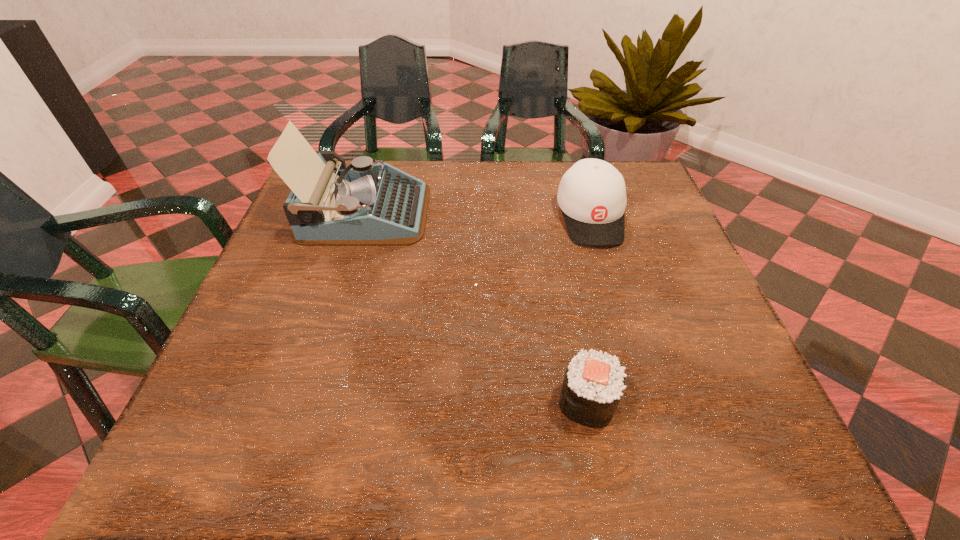
Identify the location of object situated at the near edge. (593, 384).

Identify the location of object at the left edge. The width and height of the screenshot is (960, 540). (366, 204).

Where is `object present at the right edge`? object present at the right edge is located at coordinates (592, 194).

Locate an element on the screen. object present at the far left corner is located at coordinates 366,204.

The image size is (960, 540). Identify the location of object at the far right corner. (592, 194).

In the image, there is a desktop. At what (x,y) coordinates should I click in order to perform the action: click on vacant area at the far edge. Please return your answer as a coordinate pair (x, y). This screenshot has width=960, height=540. Looking at the image, I should click on (520, 207).

In the image, there is a desktop. What are the coordinates of `vacant region at the near edge` in the screenshot? It's located at (668, 449).

This screenshot has width=960, height=540. I want to click on vacant space at the left edge of the desktop, so [x=258, y=321].

Where is `free space at the right edge of the desktop`? free space at the right edge of the desktop is located at coordinates (679, 237).

The image size is (960, 540). In order to click on vacant space at the near right corner in this screenshot , I will do (720, 444).